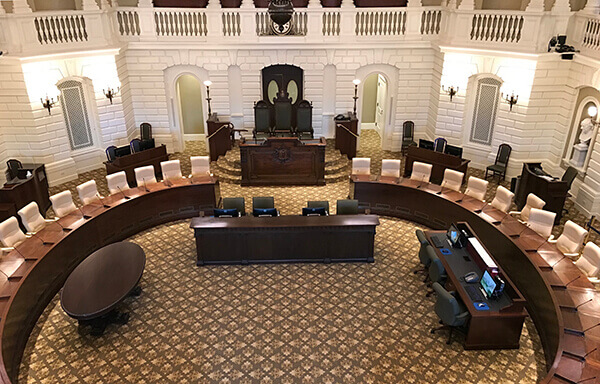
The width and height of the screenshot is (600, 384). I want to click on white chairs around desks, so click(x=50, y=206), click(x=520, y=200).